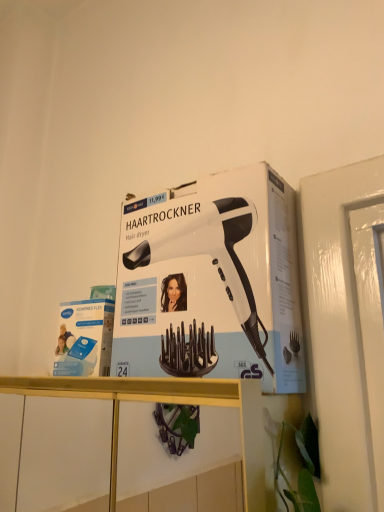
Question: Considering the relative sizes of white glossy shelf at upper center and white matte hair dryer at upper center in the image provided, is white glossy shelf at upper center smaller than white matte hair dryer at upper center?

Choices:
 (A) no
 (B) yes

Answer: (A)

Question: Can you confirm if white glossy shelf at upper center is taller than white matte hair dryer at upper center?

Choices:
 (A) no
 (B) yes

Answer: (A)

Question: Is white glossy shelf at upper center to the left of white matte hair dryer at upper center from the viewer's perspective?

Choices:
 (A) no
 (B) yes

Answer: (B)

Question: Is white glossy shelf at upper center not close to white matte hair dryer at upper center?

Choices:
 (A) no
 (B) yes

Answer: (A)

Question: Is white glossy shelf at upper center outside white matte hair dryer at upper center?

Choices:
 (A) yes
 (B) no

Answer: (A)

Question: Is white glossy shelf at upper center facing away from white matte hair dryer at upper center?

Choices:
 (A) yes
 (B) no

Answer: (B)

Question: Is white glossy shelf at upper center at the back of white matte hair dryer at upper center?

Choices:
 (A) no
 (B) yes

Answer: (A)

Question: Can you confirm if white matte hair dryer at upper center is shorter than white glossy shelf at upper center?

Choices:
 (A) yes
 (B) no

Answer: (B)

Question: From a real-world perspective, is white matte hair dryer at upper center physically above white glossy shelf at upper center?

Choices:
 (A) no
 (B) yes

Answer: (B)

Question: Would you say white matte hair dryer at upper center is outside white glossy shelf at upper center?

Choices:
 (A) yes
 (B) no

Answer: (A)

Question: Considering the relative sizes of white matte hair dryer at upper center and white glossy shelf at upper center in the image provided, is white matte hair dryer at upper center smaller than white glossy shelf at upper center?

Choices:
 (A) no
 (B) yes

Answer: (B)

Question: Can you confirm if white matte hair dryer at upper center is bigger than white glossy shelf at upper center?

Choices:
 (A) no
 (B) yes

Answer: (A)

Question: From the image's perspective, is white matte hair dryer at upper center positioned above or below white glossy shelf at upper center?

Choices:
 (A) below
 (B) above

Answer: (B)